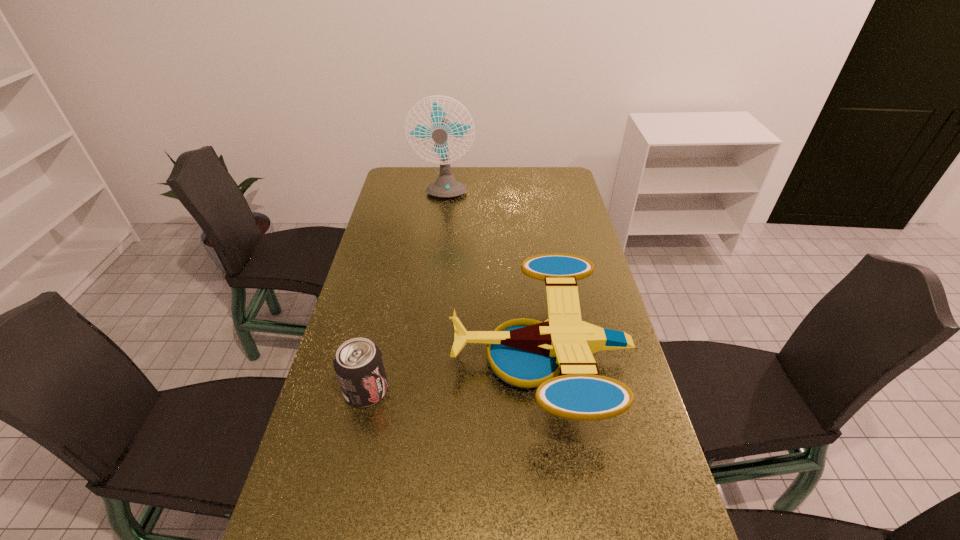
You are a GUI agent. You are given a task and a screenshot of the screen. Output one action in this format:
    pyautogui.click(x=<x>, y=<y>)
    Task: Click on the tallest object
    This screenshot has height=540, width=960.
    Given the screenshot: What is the action you would take?
    pyautogui.click(x=446, y=186)

This screenshot has width=960, height=540. I want to click on fan, so click(x=446, y=186).

Locate an element on the screen. This screenshot has width=960, height=540. drone is located at coordinates [526, 353].

Identify the location of soda can. (358, 363).

The width and height of the screenshot is (960, 540). I want to click on vacant position located on the front-facing side of the tallest object, so click(436, 268).

This screenshot has width=960, height=540. I want to click on vacant point located 0.140m at the cockpit of the drone, so click(401, 358).

This screenshot has height=540, width=960. I want to click on vacant region located 0.230m at the cockpit of the drone, so click(369, 358).

This screenshot has height=540, width=960. I want to click on vacant space positioned 0.120m at the cockpit of the drone, so click(x=409, y=358).

Locate an element on the screen. The image size is (960, 540). vacant space located 0.340m on the back of the soda can is located at coordinates (390, 288).

Identify the location of object located in the far edge section of the desktop. (446, 186).